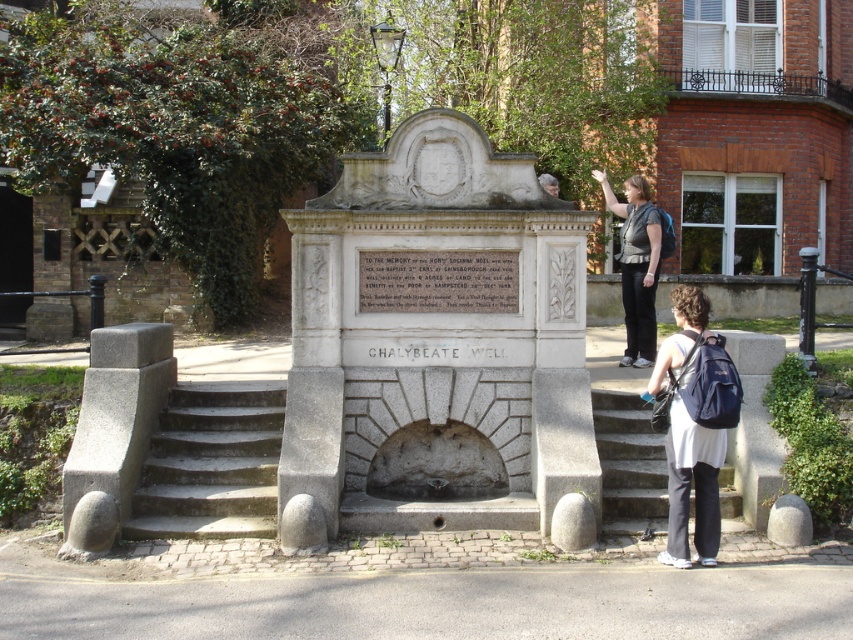
You are a tourist visiting the Chalybeate Well monument. You see the white stone fountain at center and the dark gray fabric jacket at upper center. Which object is larger in size?

The white stone fountain at center is bigger than the dark gray fabric jacket at upper center according to the description provided.

You are a tourist visiting the Chalybeate Well monument. You see the gray concrete stairs at lower left and the dark blue backpack at lower right. Which object is located lower in the image?

The gray concrete stairs at lower left is positioned under the dark blue backpack at lower right, so the stairs are lower in the image.

You are a tourist visiting the Chalybeate Well monument. You see the white stone fountain at center and the dark blue backpack at lower right. Which object is positioned to the left when viewed from your perspective?

The white stone fountain at center is positioned to the left of the dark blue backpack at lower right.